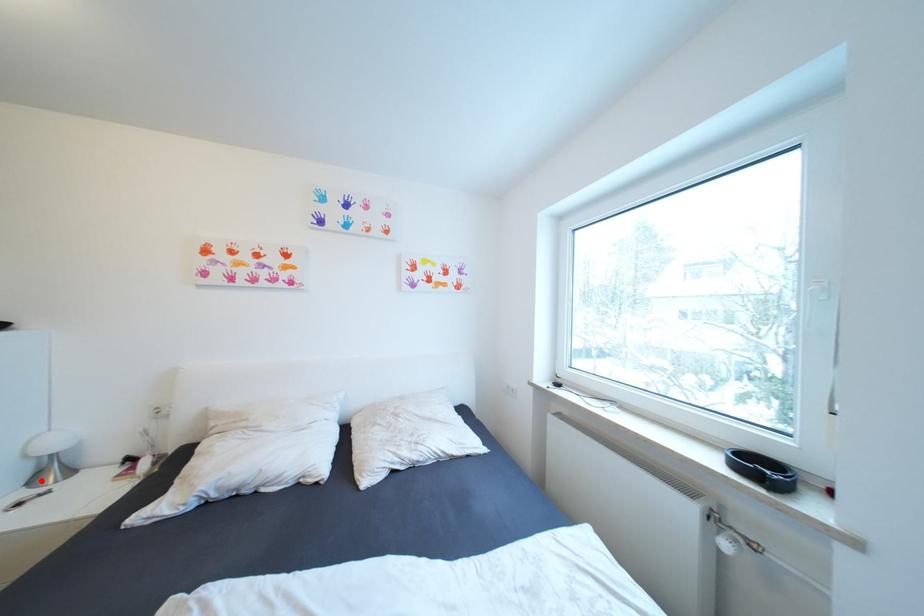
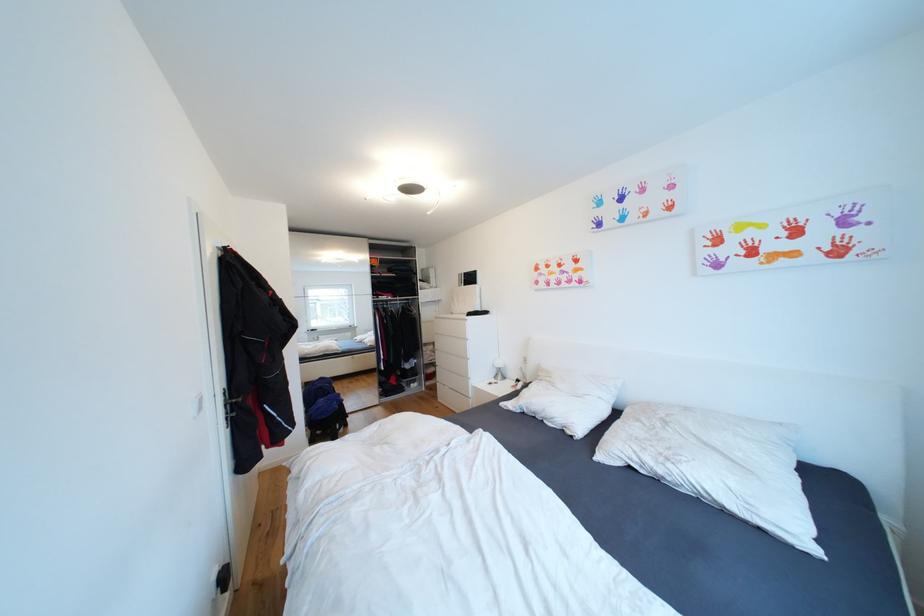
Question: I am providing you with two images of the same scene from different viewpoints. Image1 has a red point marked. In image2, the corresponding 3D location appears at what relative position? Reply with the corresponding letter.

Choices:
 (A) Closer
 (B) Farther

Answer: (B)